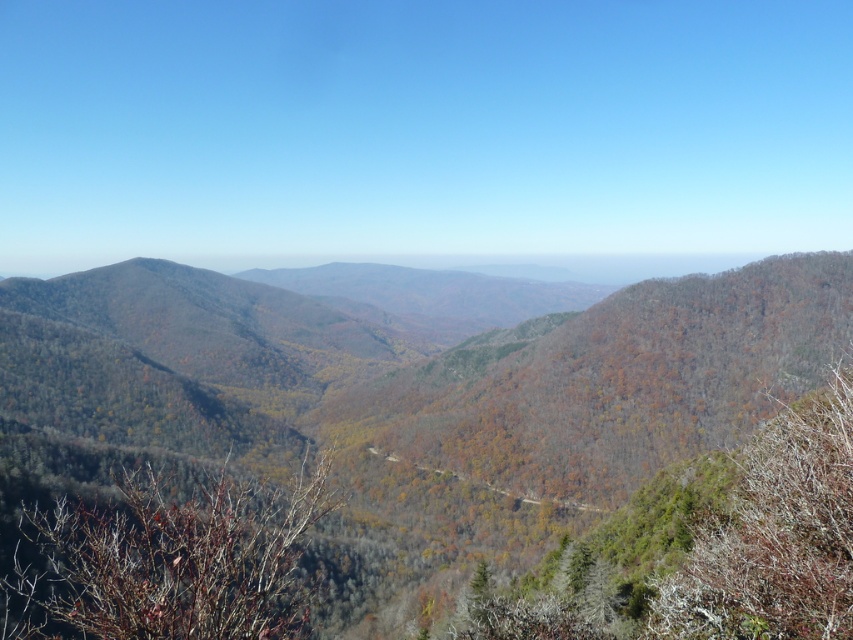
Question: Does brown textured tree at center appear over brown textured tree at right?

Choices:
 (A) no
 (B) yes

Answer: (A)

Question: In this image, where is brown textured tree at center located relative to brown textured tree at right?

Choices:
 (A) below
 (B) above

Answer: (A)

Question: Can you confirm if brown textured tree at center is positioned to the left of brown textured tree at right?

Choices:
 (A) no
 (B) yes

Answer: (B)

Question: Among these points, which one is farthest from the camera?

Choices:
 (A) (30, 524)
 (B) (757, 557)

Answer: (A)

Question: Which point is farther to the camera?

Choices:
 (A) (119, 637)
 (B) (792, 538)

Answer: (B)